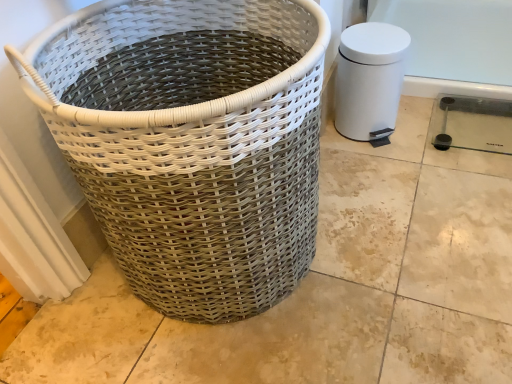
The height and width of the screenshot is (384, 512). Find the location of `white woven basket at left`. white woven basket at left is located at coordinates (191, 142).

This screenshot has height=384, width=512. What do you see at coordinates (191, 142) in the screenshot?
I see `white woven basket at left` at bounding box center [191, 142].

What is the approximate width of white matte water heater at right?

It is 7.00 inches.

The height and width of the screenshot is (384, 512). What do you see at coordinates (369, 81) in the screenshot? I see `white matte water heater at right` at bounding box center [369, 81].

Image resolution: width=512 pixels, height=384 pixels. What are the coordinates of `white matte water heater at right` in the screenshot? It's located at (369, 81).

Where is `white woven basket at left`? white woven basket at left is located at coordinates (191, 142).

Is white woven basket at left at the left side of white matte water heater at right?

Correct, you'll find white woven basket at left to the left of white matte water heater at right.

Which object is further away from the camera, white woven basket at left or white matte water heater at right?

Positioned behind is white matte water heater at right.

Does point (319, 45) come farther from viewer compared to point (353, 33)?

No, it is in front of (353, 33).

From the image's perspective, between white woven basket at left and white matte water heater at right, who is located below?

white woven basket at left, from the image's perspective.

From a real-world perspective, which object stands above the other?

white woven basket at left.

In the scene shown: Which object is thinner, white woven basket at left or white matte water heater at right?

With smaller width is white matte water heater at right.

Who is taller, white woven basket at left or white matte water heater at right?

white woven basket at left is taller.

Does white woven basket at left have a larger size compared to white matte water heater at right?

Yes, white woven basket at left is bigger than white matte water heater at right.

Is white woven basket at left spatially inside white matte water heater at right, or outside of it?

white woven basket at left lies outside white matte water heater at right.

Is there a large distance between white woven basket at left and white matte water heater at right?

No, white woven basket at left is not far away from white matte water heater at right.

Is white matte water heater at right at the back of white woven basket at left?

No.

This screenshot has height=384, width=512. What are the coordinates of `water heater located underneath the white woven basket at left (from a real-world perspective)` in the screenshot? It's located at 369,81.

Is white matte water heater at right to the left of white woven basket at left from the viewer's perspective?

Incorrect, white matte water heater at right is not on the left side of white woven basket at left.

Is the position of white matte water heater at right more distant than that of white woven basket at left?

Yes, the depth of white matte water heater at right is greater than that of white woven basket at left.

Does point (369, 98) appear closer or farther from the camera than point (306, 183)?

Point (369, 98) is positioned farther from the camera compared to point (306, 183).

From the image's perspective, which is above, white matte water heater at right or white woven basket at left?

white matte water heater at right, from the image's perspective.

From a real-world perspective, relative to white woven basket at left, is white matte water heater at right vertically above or below?

white matte water heater at right is below white woven basket at left.

Consider the image. Does white matte water heater at right have a lesser width compared to white woven basket at left?

Indeed, white matte water heater at right has a lesser width compared to white woven basket at left.

Is white matte water heater at right taller than white woven basket at left?

No, white matte water heater at right is not taller than white woven basket at left.

Which of these two, white matte water heater at right or white woven basket at left, is smaller?

Smaller between the two is white matte water heater at right.

Do you think white matte water heater at right is within white woven basket at left, or outside of it?

white matte water heater at right is outside white woven basket at left.

Is the surface of white matte water heater at right in direct contact with white woven basket at left?

No, white matte water heater at right is not next to white woven basket at left.

Is white woven basket at left at the back of white matte water heater at right?

No, white matte water heater at right is not facing away from white woven basket at left.

In the scene shown: How distant is white matte water heater at right from white woven basket at left?

A distance of 18.66 inches exists between white matte water heater at right and white woven basket at left.

Find the location of `water heater on the right of white woven basket at left`. water heater on the right of white woven basket at left is located at coordinates (369, 81).

In order to click on water heater behind the white woven basket at left in this screenshot , I will do `click(369, 81)`.

At what (x,y) coordinates should I click in order to perform the action: click on waste container located above the white matte water heater at right (from a real-world perspective). Please return your answer as a coordinate pair (x, y). The width and height of the screenshot is (512, 384). Looking at the image, I should click on (191, 142).